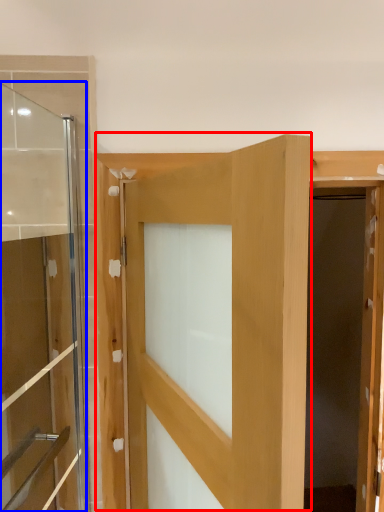
Question: Which point is further to the camera, door (highlighted by a red box) or door (highlighted by a blue box)?

Choices:
 (A) door
 (B) door

Answer: (B)